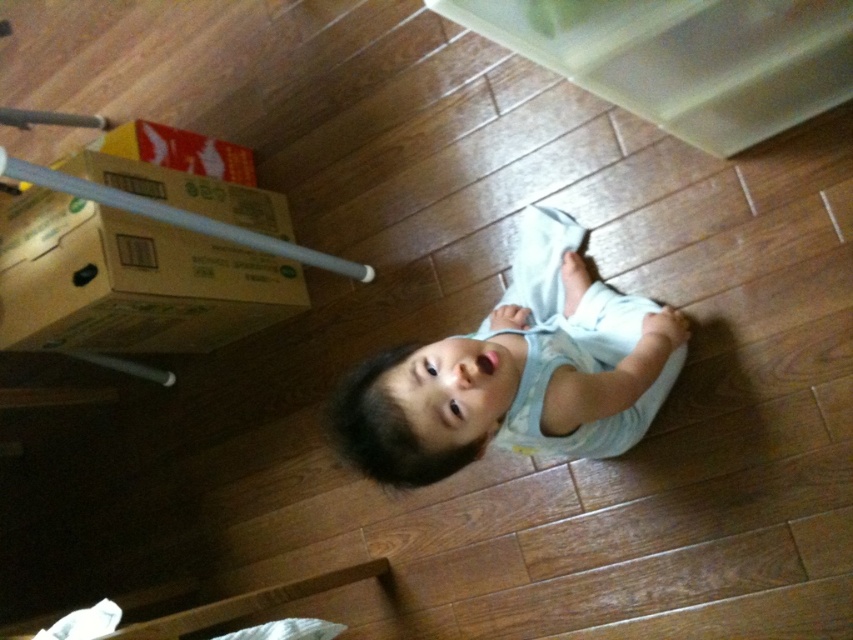
Which is below, light blue fabric at center or green cardboard box at left?

Positioned lower is light blue fabric at center.

Is light blue fabric at center above green cardboard box at left?

No, light blue fabric at center is not above green cardboard box at left.

Who is more distant from viewer, (549, 317) or (196, 211)?

The point (196, 211) is behind.

This screenshot has height=640, width=853. Find the location of `light blue fabric at center`. light blue fabric at center is located at coordinates (518, 372).